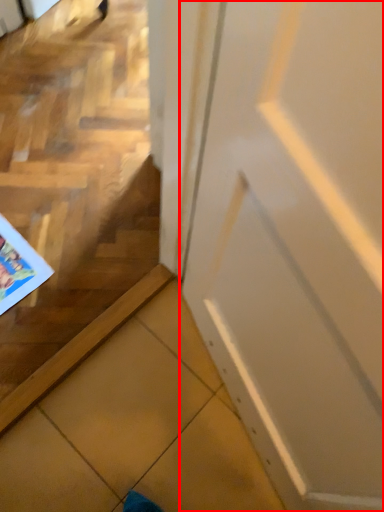
Question: In this image, where is door (annotated by the red box) located relative to comic book?

Choices:
 (A) right
 (B) left

Answer: (A)